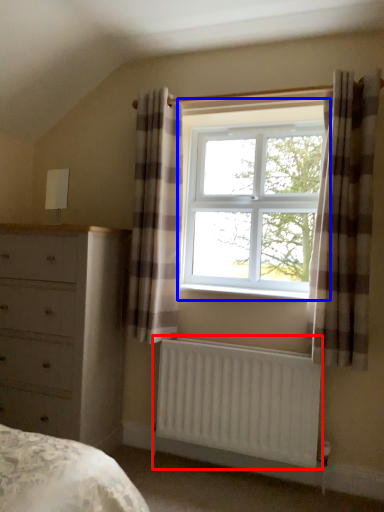
Question: Among these objects, which one is farthest to the camera, radiator (highlighted by a red box) or window (highlighted by a blue box)?

Choices:
 (A) radiator
 (B) window

Answer: (B)